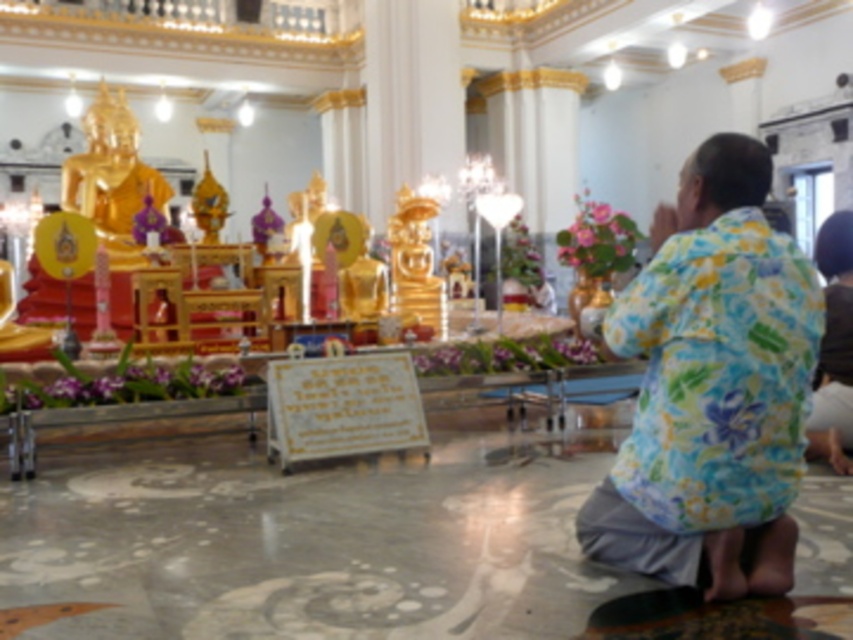
You are a tour guide leading a group through this temple. You need to ensure that visitors maintain a minimum distance of 2 meters between each other for safety. There is a visitor wearing a floral fabric shirt at center and another wearing a floral print shirt at lower right. Are they currently maintaining the required distance?

The distance between the floral fabric shirt at center and the floral print shirt at lower right is 1.86 meters, which is less than the required 2 meters. Therefore, they are not maintaining the required distance.

You are an interior designer planning to hang a decorative banner between the floral fabric shirt at center and the floral print shirt at lower right. Which shirt should the banner be hung closer to if the banner needs to be placed above both shirts?

The banner should be hung closer to the floral fabric shirt at center because it is positioned under the floral print shirt at lower right, meaning the floral print shirt at lower right is higher up, so placing the banner above both would require it to be closer to the lower shirt.

In the temple scene, there is a person wearing a floral fabric shirt at center. Where exactly is this person located in terms of coordinates?

The floral fabric shirt at center is located at coordinates point [712,387].